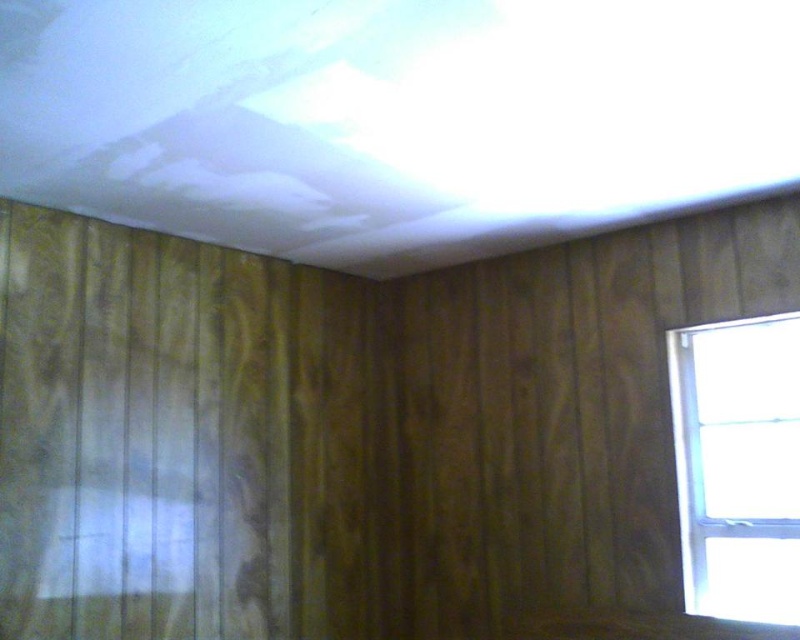
Is wooden paneling at left taller than white plastic window at right?

Yes.

Who is positioned more to the right, wooden paneling at left or white plastic window at right?

From the viewer's perspective, white plastic window at right appears more on the right side.

The width and height of the screenshot is (800, 640). I want to click on wooden paneling at left, so click(140, 435).